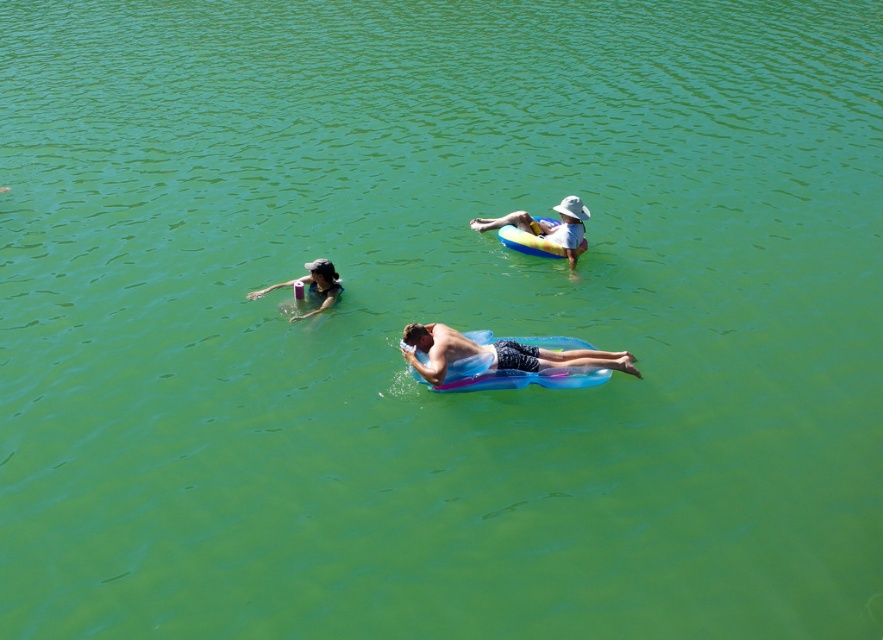
Who is positioned more to the left, translucent blue float at center or matte black swim cap at upper left?

matte black swim cap at upper left is more to the left.

Describe the element at coordinates (494, 355) in the screenshot. I see `translucent blue float at center` at that location.

This screenshot has height=640, width=883. What are the coordinates of `translucent blue float at center` in the screenshot? It's located at (494, 355).

Measure the distance from translucent blue float at center to blue rubber ring at upper center.

The distance of translucent blue float at center from blue rubber ring at upper center is 3.18 meters.

Can you confirm if translucent blue float at center is smaller than blue rubber ring at upper center?

Yes.

Does point (419, 337) come behind point (512, 212)?

No, (419, 337) is in front of (512, 212).

I want to click on translucent blue float at center, so click(x=494, y=355).

Who is positioned more to the right, blue rubber ring at upper center or matte black swim cap at upper left?

blue rubber ring at upper center

Which is behind, point (577, 248) or point (306, 262)?

Point (306, 262)

Which is behind, point (565, 250) or point (326, 288)?

Positioned behind is point (565, 250).

Locate an element on the screen. blue rubber ring at upper center is located at coordinates (547, 227).